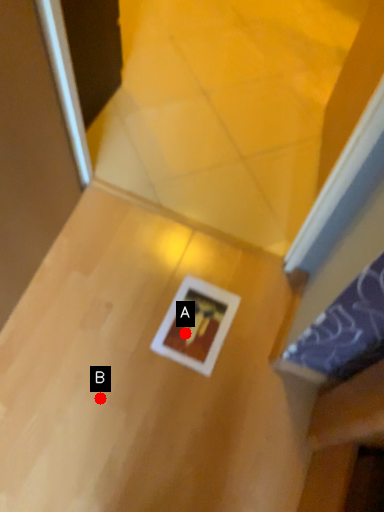
Question: Two points are circled on the image, labeled by A and B beside each circle. Which point is further to the camera?

Choices:
 (A) A is further
 (B) B is further

Answer: (A)